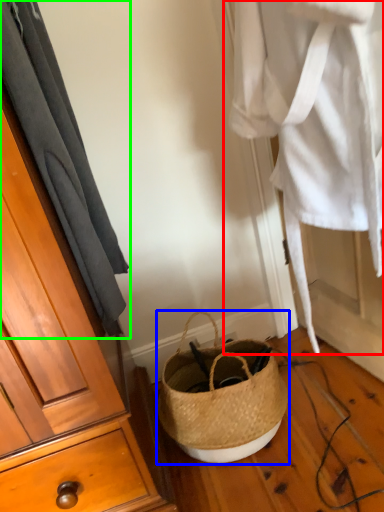
Question: Based on their relative distances, which object is farther from clothing (highlighted by a red box)? Choose from handbag (highlighted by a blue box) and curtain (highlighted by a green box).

Choices:
 (A) handbag
 (B) curtain

Answer: (A)